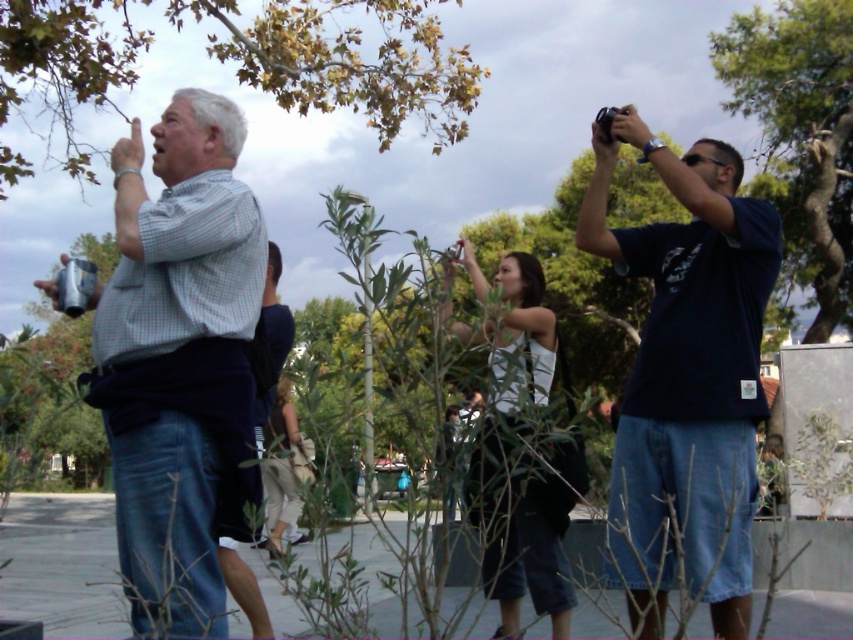
You are a photographer standing at the center of the scene. You want to take a photo of the checkered fabric shirt at left and the person with the camera at right. How far apart are these two subjects?

The checkered fabric shirt at left and the person with the camera at right are 1.64 meters apart.